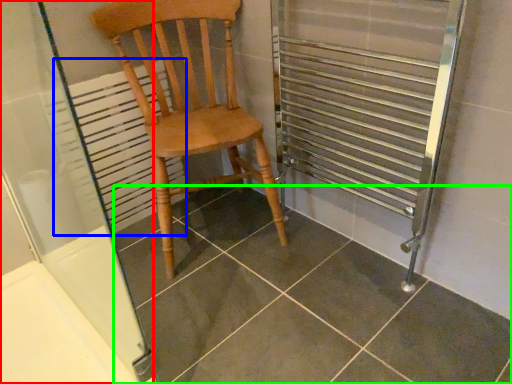
Question: Which object is the closest to the screen door (highlighted by a red box)? Choose among these: radiator (highlighted by a blue box) or tile (highlighted by a green box).

Choices:
 (A) radiator
 (B) tile

Answer: (A)